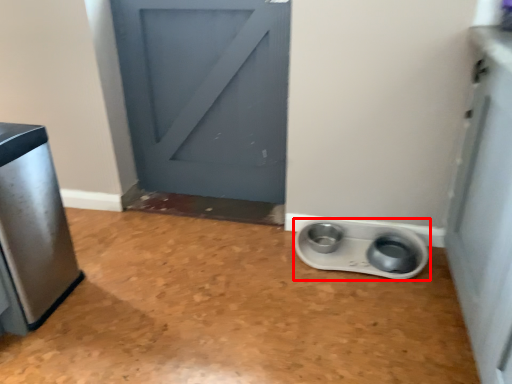
Question: From the image's perspective, considering the relative positions of appliance (annotated by the red box) and home appliance in the image provided, where is appliance (annotated by the red box) located with respect to the staircase?

Choices:
 (A) below
 (B) above

Answer: (A)